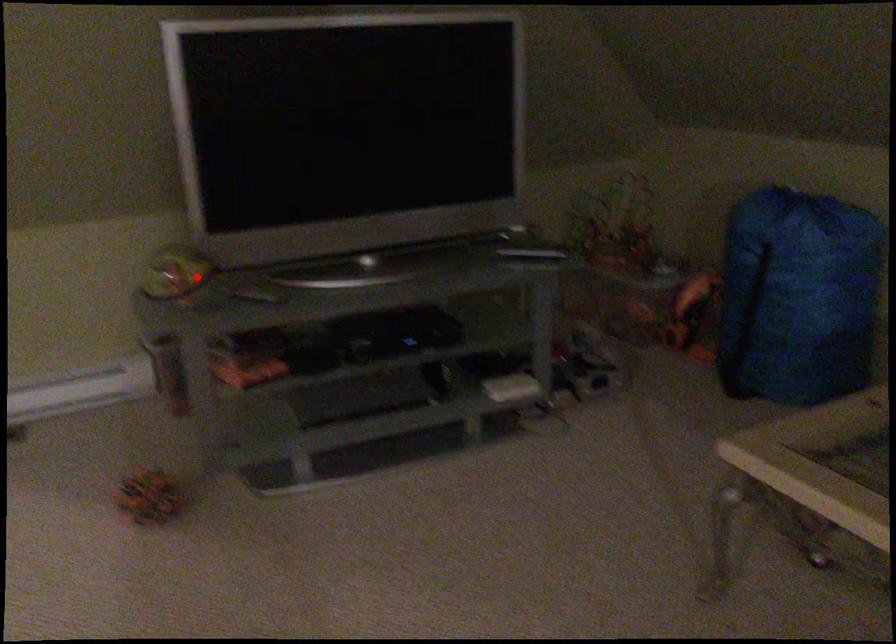
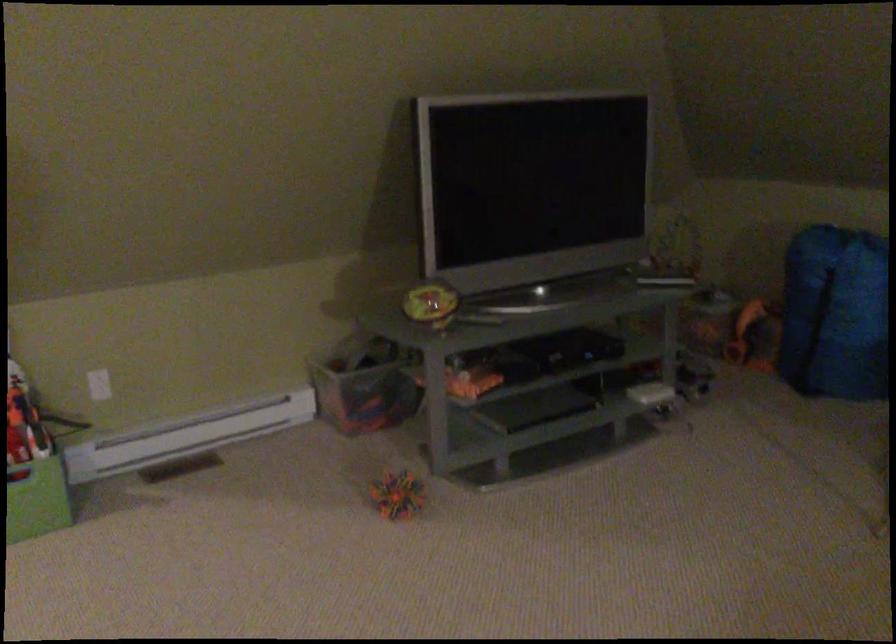
The point at the highlighted location is marked in the first image. Where is the corresponding point in the second image?

(429, 301)